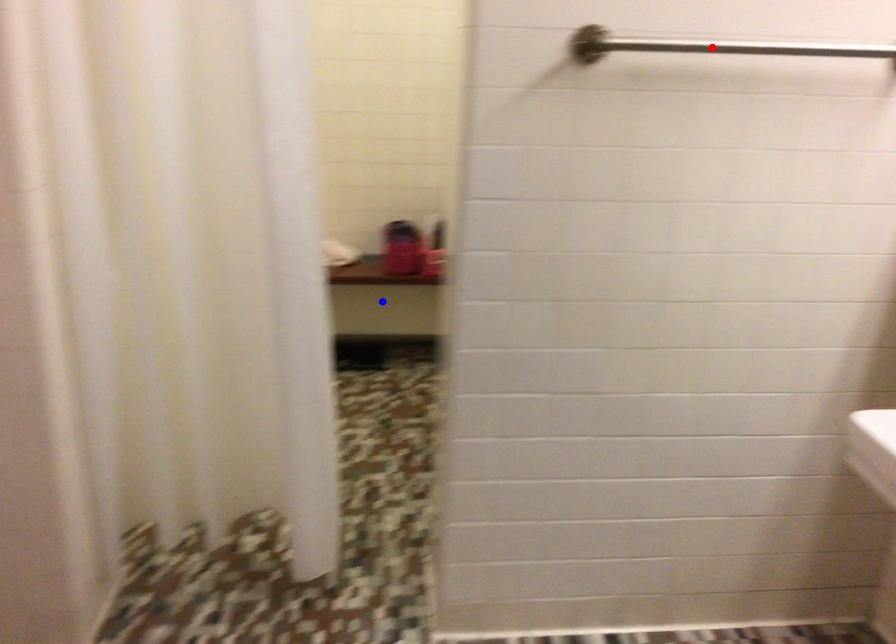
Question: In the image, two points are highlighted. Which point is nearer to the camera? Reply with the corresponding letter.

Choices:
 (A) blue point
 (B) red point

Answer: (B)